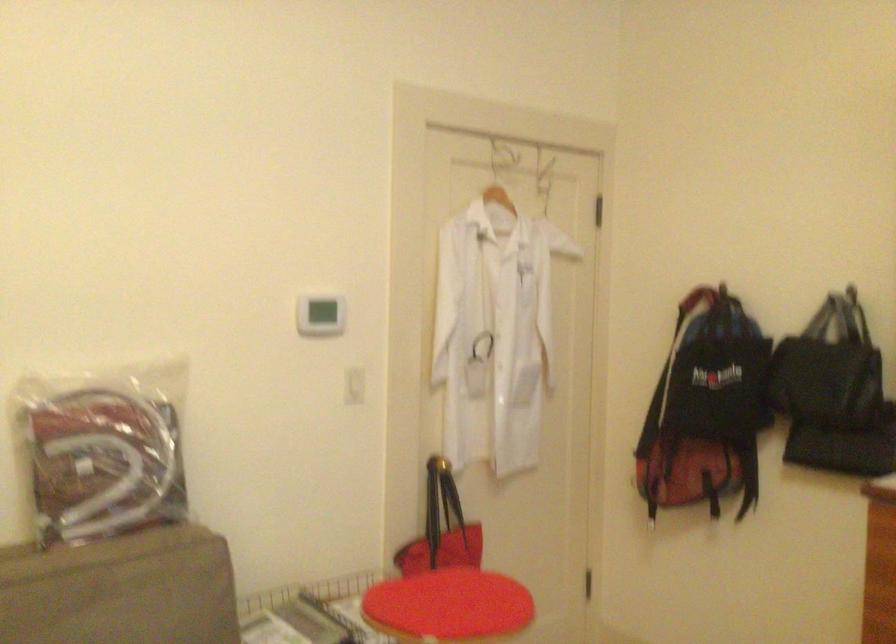
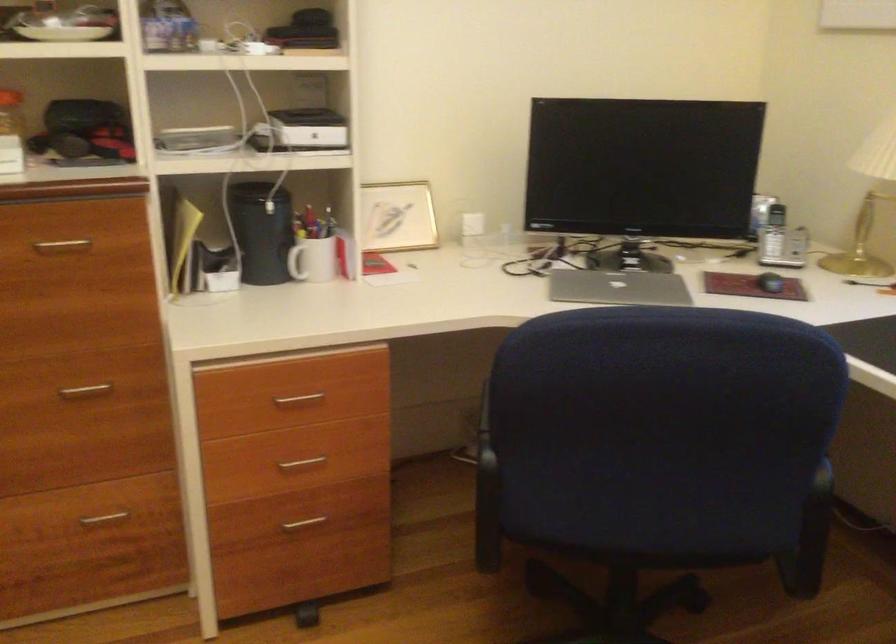
Based on the continuous images, in which direction is the camera rotating?

The camera rotated toward right-down.